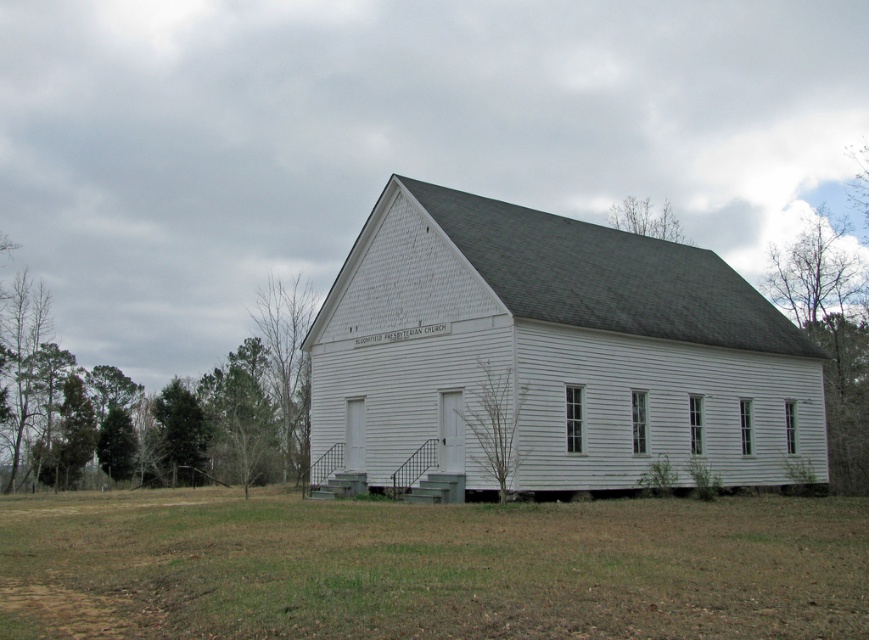
Question: Which of these objects is positioned closest to the green leafy tree at left?

Choices:
 (A) bare branches at lower center
 (B) white wood barn at center
 (C) brown grass at lower center

Answer: (B)

Question: Which point appears closest to the camera in this image?

Choices:
 (A) (635, 582)
 (B) (465, 416)

Answer: (A)

Question: Considering the relative positions of white wood barn at center and bare branches at upper center in the image provided, where is white wood barn at center located with respect to bare branches at upper center?

Choices:
 (A) left
 (B) right

Answer: (A)

Question: Does bare branches at lower center appear over green leafy tree at left?

Choices:
 (A) no
 (B) yes

Answer: (B)

Question: Does green leafy tree at lower left have a greater width compared to bare branches at left?

Choices:
 (A) yes
 (B) no

Answer: (A)

Question: Estimate the real-world distances between objects in this image. Which object is farther from the bare branches at left?

Choices:
 (A) bare branches at lower center
 (B) green leafy tree at left

Answer: (A)